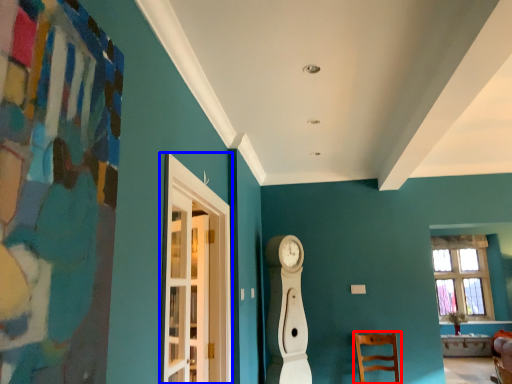
Question: Which object is closer to the camera taking this photo, chair (highlighted by a red box) or glass door (highlighted by a blue box)?

Choices:
 (A) chair
 (B) glass door

Answer: (B)